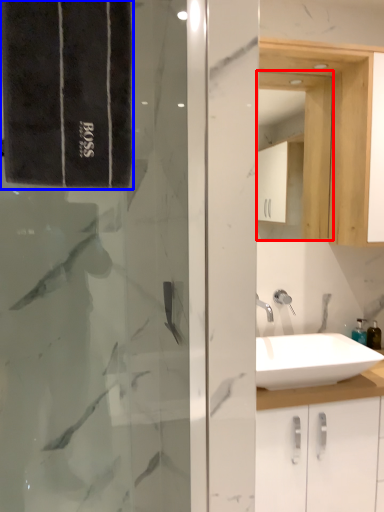
Question: Which object appears farthest to the camera in this image, medicine cabinet (highlighted by a red box) or bath towel (highlighted by a blue box)?

Choices:
 (A) medicine cabinet
 (B) bath towel

Answer: (A)